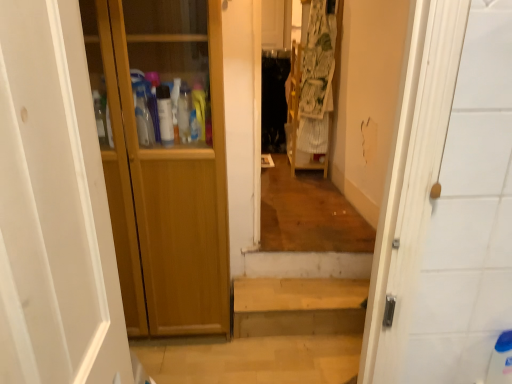
At what (x,y) coordinates should I click in order to perform the action: click on free spot above wooden stairs at center (from a real-world perspective). Please return your answer as a coordinate pair (x, y). Looking at the image, I should click on (288, 289).